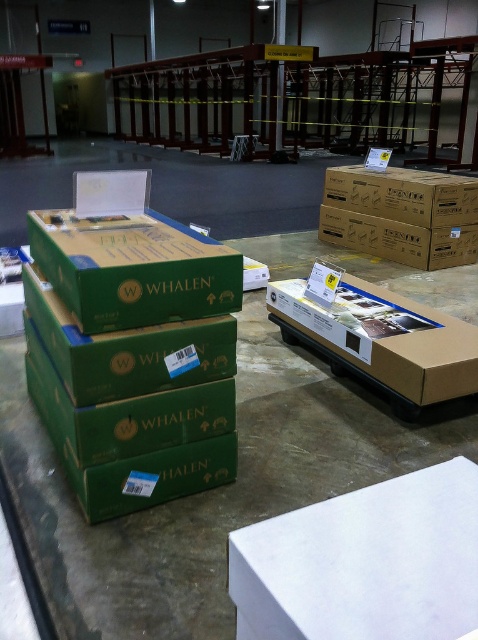
Question: Which point is farther from the camera taking this photo?

Choices:
 (A) (368, 289)
 (B) (199, 445)

Answer: (A)

Question: Is green cardboard box at center in front of matte cardboard box at center?

Choices:
 (A) no
 (B) yes

Answer: (B)

Question: Is green cardboard box at center closer to the viewer compared to brown cardboard box at upper right?

Choices:
 (A) no
 (B) yes

Answer: (B)

Question: Which is nearer to the green cardboard box at center?

Choices:
 (A) brown cardboard box at upper right
 (B) matte cardboard box at center

Answer: (B)

Question: Does matte cardboard box at center appear over brown cardboard box at upper right?

Choices:
 (A) yes
 (B) no

Answer: (B)

Question: Which of the following is the farthest from the observer?

Choices:
 (A) (332, 189)
 (B) (382, 376)

Answer: (A)